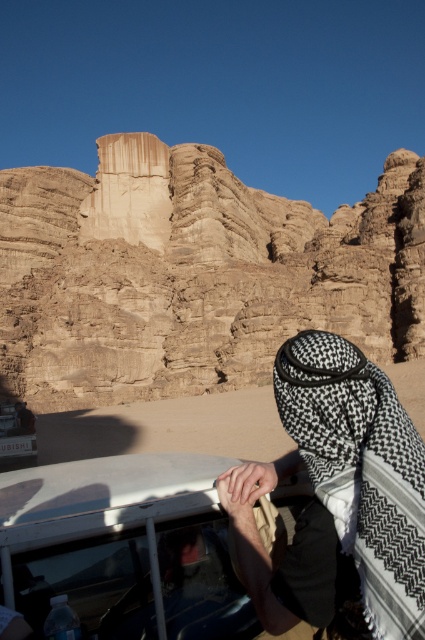
Question: Which of the following is the closest to the observer?

Choices:
 (A) black checkered headscarf at right
 (B) smooth sandstone rock formation at center

Answer: (A)

Question: Estimate the real-world distances between objects in this image. Which object is closer to the black checkered headscarf at right?

Choices:
 (A) smooth sandstone rock formation at center
 (B) metallic silver car at lower left

Answer: (B)

Question: Considering the relative positions of smooth sandstone rock formation at center and black checkered headscarf at right in the image provided, where is smooth sandstone rock formation at center located with respect to black checkered headscarf at right?

Choices:
 (A) right
 (B) left

Answer: (A)

Question: Considering the relative positions of smooth sandstone rock formation at center and metallic silver car at lower left in the image provided, where is smooth sandstone rock formation at center located with respect to metallic silver car at lower left?

Choices:
 (A) right
 (B) left

Answer: (A)

Question: Estimate the real-world distances between objects in this image. Which object is farther from the black checkered headscarf at right?

Choices:
 (A) smooth sandstone rock formation at center
 (B) metallic silver car at lower left

Answer: (A)

Question: Observing the image, what is the correct spatial positioning of smooth sandstone rock formation at center in reference to metallic silver car at lower left?

Choices:
 (A) below
 (B) above

Answer: (B)